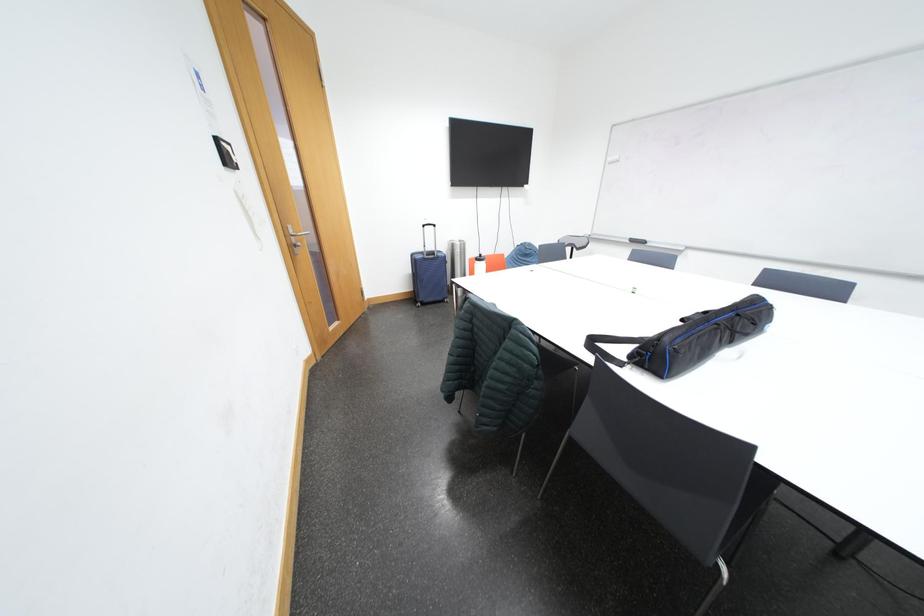
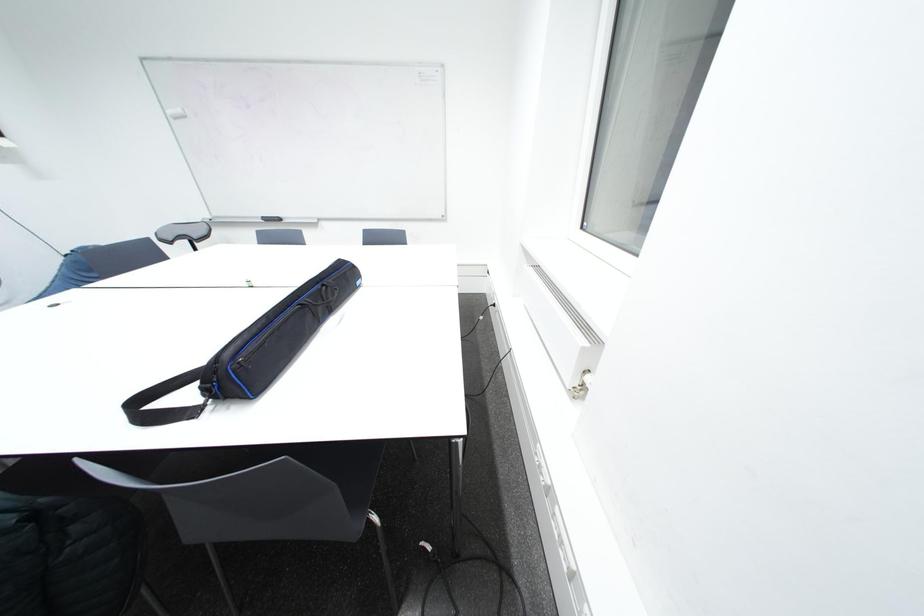
How did the camera likely rotate?

The camera rotated toward right-down.